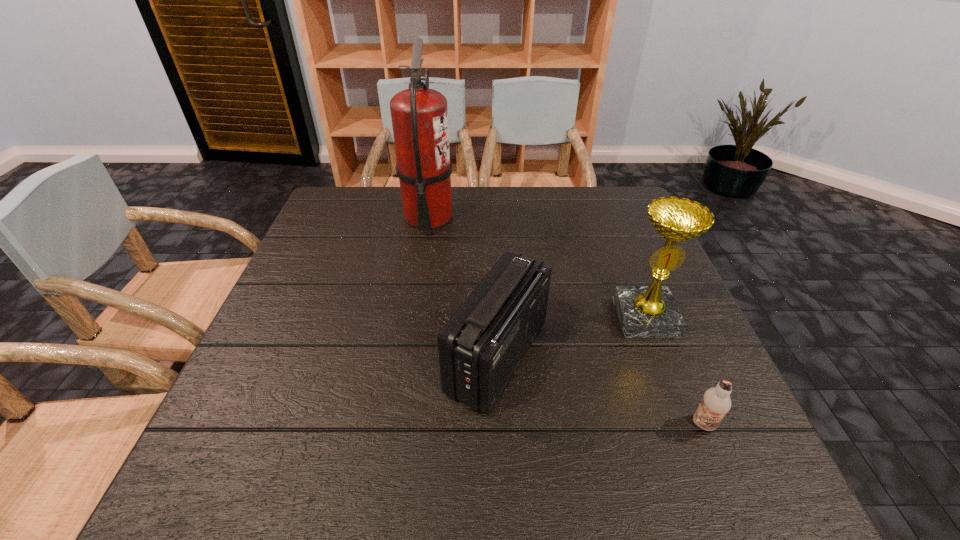
Find the location of a particular element. object that is the closest one to the second shortest object is located at coordinates (651, 311).

Where is `object that stands as the second closest to the third shortest object`? The height and width of the screenshot is (540, 960). object that stands as the second closest to the third shortest object is located at coordinates (716, 403).

Identify the location of vacant space that satisfies the following two spatial constraints: 1. on the front-facing side of the award; 2. on the right side of the shortest object. This screenshot has width=960, height=540. (687, 424).

At what (x,y) coordinates should I click in order to perform the action: click on free space that satisfies the following two spatial constraints: 1. on the front-facing side of the second tallest object; 2. on the left side of the shortest object. Please return your answer as a coordinate pair (x, y). Looking at the image, I should click on (687, 424).

I want to click on vacant space that satisfies the following two spatial constraints: 1. on the front-facing side of the third shortest object; 2. on the front panel of the third object from right to left, so click(660, 357).

I want to click on vacant space that satisfies the following two spatial constraints: 1. on the front-facing side of the award; 2. on the left side of the shortest object, so click(x=687, y=424).

Where is `vacant region that satisfies the following two spatial constraints: 1. on the front-facing side of the chocolate milk; 2. on the right side of the third shortest object`? vacant region that satisfies the following two spatial constraints: 1. on the front-facing side of the chocolate milk; 2. on the right side of the third shortest object is located at coordinates (687, 424).

I want to click on free spot that satisfies the following two spatial constraints: 1. toward the nozzle of the tallest object; 2. on the back side of the shortest object, so pos(396,424).

This screenshot has width=960, height=540. Identify the location of free space that satisfies the following two spatial constraints: 1. toward the nozzle of the chocolate milk; 2. on the left side of the farthest object. (396, 424).

The image size is (960, 540). Find the location of `free space that satisfies the following two spatial constraints: 1. on the front-facing side of the shortest object; 2. on the right side of the award`. free space that satisfies the following two spatial constraints: 1. on the front-facing side of the shortest object; 2. on the right side of the award is located at coordinates (687, 424).